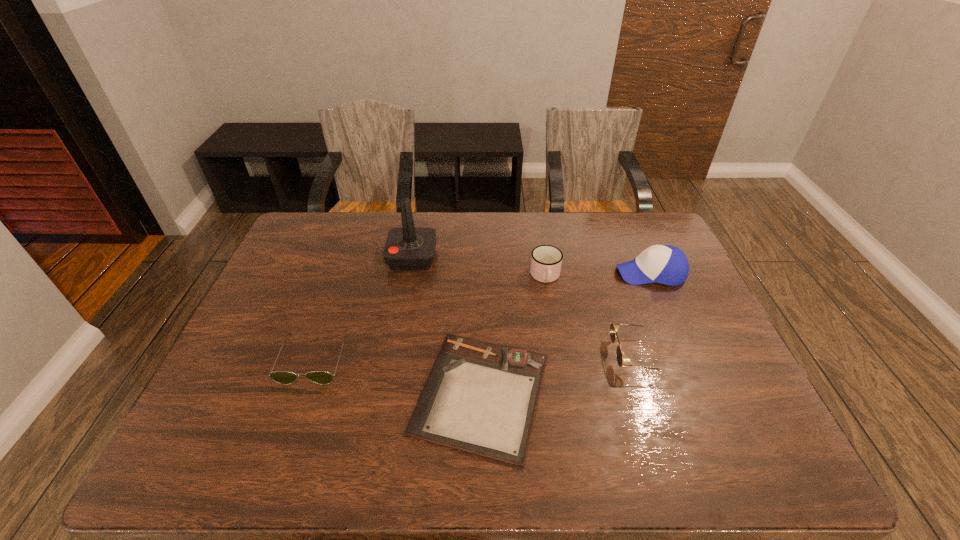
Where is `unoccupied area between the mug and the fifth shortest object`? The image size is (960, 540). unoccupied area between the mug and the fifth shortest object is located at coordinates (598, 275).

Find the location of a particular element. This screenshot has width=960, height=540. free point between the baseball cap and the taller sunglasses is located at coordinates click(643, 314).

Image resolution: width=960 pixels, height=540 pixels. I want to click on empty space that is in between the mug and the joystick, so click(x=479, y=267).

Locate an element on the screen. empty space that is in between the second tallest object and the leftmost object is located at coordinates (482, 316).

Locate an element on the screen. free spot between the right sunglasses and the baseball cap is located at coordinates (643, 314).

Identify which object is the closest to the mug. Please provide its 2D coordinates. Your answer should be formatted as a tuple, i.e. [(x, y)], where the tuple contains the x and y coordinates of a point satisfying the conditions above.

[(480, 397)]

Locate an element on the screen. The height and width of the screenshot is (540, 960). the closest object relative to the baseball cap is located at coordinates (546, 260).

The height and width of the screenshot is (540, 960). Find the location of `vacant space that satisfies the following two spatial constraints: 1. on the front lenses of the right sunglasses; 2. on the front side of the clipboard`. vacant space that satisfies the following two spatial constraints: 1. on the front lenses of the right sunglasses; 2. on the front side of the clipboard is located at coordinates (648, 393).

Find the location of a particular element. This screenshot has width=960, height=540. free space in the image that satisfies the following two spatial constraints: 1. on the front-facing side of the baseball cap; 2. on the side of the mug with the handle is located at coordinates (652, 277).

This screenshot has width=960, height=540. In order to click on free space that satisfies the following two spatial constraints: 1. on the front-facing side of the baseball cap; 2. on the front-facing side of the shorter sunglasses in this screenshot , I will do `click(688, 360)`.